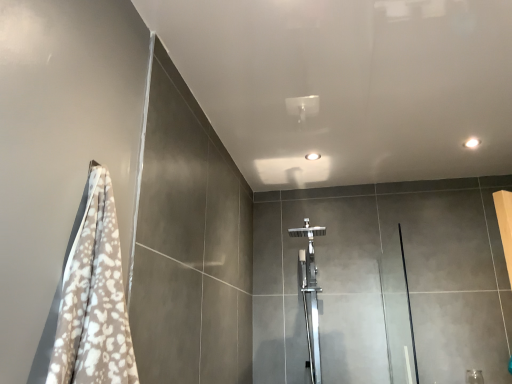
What do you see at coordinates (398, 315) in the screenshot?
I see `transparent glass screen door at right` at bounding box center [398, 315].

What is the approximate width of transparent glass screen door at right?

transparent glass screen door at right is 37.27 inches in width.

Where is `transparent glass screen door at right`? This screenshot has height=384, width=512. transparent glass screen door at right is located at coordinates (398, 315).

Describe the element at coordinates (310, 295) in the screenshot. The image size is (512, 384). I see `polished chrome shower at center` at that location.

This screenshot has width=512, height=384. Find the location of `polished chrome shower at center`. polished chrome shower at center is located at coordinates (310, 295).

Identify the location of transparent glass screen door at right. The image size is (512, 384). (398, 315).

Does transparent glass screen door at right appear on the right side of polished chrome shower at center?

Yes.

Is transparent glass screen door at right positioned before polished chrome shower at center?

Yes.

Does point (387, 350) come farther from viewer compared to point (314, 259)?

No, it is not.

From the image's perspective, who appears lower, transparent glass screen door at right or polished chrome shower at center?

transparent glass screen door at right is shown below in the image.

From a real-world perspective, is transparent glass screen door at right on polished chrome shower at center?

No, from a real-world perspective, transparent glass screen door at right is not over polished chrome shower at center

Considering the relative sizes of transparent glass screen door at right and polished chrome shower at center in the image provided, is transparent glass screen door at right thinner than polished chrome shower at center?

Incorrect, the width of transparent glass screen door at right is not less than that of polished chrome shower at center.

In the scene shown: Is transparent glass screen door at right shorter than polished chrome shower at center?

Yes, transparent glass screen door at right is shorter than polished chrome shower at center.

Between transparent glass screen door at right and polished chrome shower at center, which one has smaller size?

With smaller size is transparent glass screen door at right.

Would you say transparent glass screen door at right is outside polished chrome shower at center?

Indeed, transparent glass screen door at right is completely outside polished chrome shower at center.

Are transparent glass screen door at right and polished chrome shower at center far apart?

transparent glass screen door at right is near polished chrome shower at center, not far away.

Could you tell me if transparent glass screen door at right is facing polished chrome shower at center?

No, transparent glass screen door at right is not turned towards polished chrome shower at center.

How different are the orientations of transparent glass screen door at right and polished chrome shower at center in degrees?

transparent glass screen door at right and polished chrome shower at center are facing 0.000324 degrees away from each other.

How far apart are transparent glass screen door at right and polished chrome shower at center?

transparent glass screen door at right and polished chrome shower at center are 17.11 inches apart from each other.

The image size is (512, 384). Identify the location of shower that is above the transparent glass screen door at right (from a real-world perspective). (310, 295).

Consider the image. Which object is positioned more to the left, polished chrome shower at center or transparent glass screen door at right?

polished chrome shower at center.

From the picture: Is the position of polished chrome shower at center more distant than that of transparent glass screen door at right?

Yes, the depth of polished chrome shower at center is greater than that of transparent glass screen door at right.

Does point (319, 228) lie behind point (409, 312)?

Yes, point (319, 228) is farther from viewer.

From the image's perspective, is polished chrome shower at center above or below transparent glass screen door at right?

polished chrome shower at center is above transparent glass screen door at right.

From a real-world perspective, is polished chrome shower at center located beneath transparent glass screen door at right?

No, from a real-world perspective, polished chrome shower at center is not below transparent glass screen door at right.

Which object is thinner, polished chrome shower at center or transparent glass screen door at right?

Thinner between the two is polished chrome shower at center.

Does polished chrome shower at center have a lesser height compared to transparent glass screen door at right?

No.

Does polished chrome shower at center have a larger size compared to transparent glass screen door at right?

Yes, polished chrome shower at center is bigger than transparent glass screen door at right.

Looking at this image, can transparent glass screen door at right be found inside polished chrome shower at center?

No.

Are polished chrome shower at center and transparent glass screen door at right beside each other?

They are not placed beside each other.

Is polished chrome shower at center oriented away from transparent glass screen door at right?

No.

How many degrees apart are the facing directions of polished chrome shower at center and transparent glass screen door at right?

They differ by 0.000324 degrees in their facing directions.

Where is `shower lying behind the transparent glass screen door at right`? shower lying behind the transparent glass screen door at right is located at coordinates (310, 295).

The width and height of the screenshot is (512, 384). I want to click on shower behind the transparent glass screen door at right, so tap(310, 295).

I want to click on shower above the transparent glass screen door at right (from the image's perspective), so click(x=310, y=295).